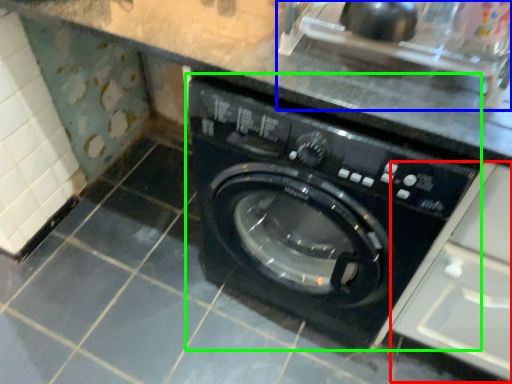
Question: Based on their relative distances, which object is farther from drawer (highlighted by a red box)? Choose from sink (highlighted by a blue box) and washing machine (highlighted by a green box).

Choices:
 (A) sink
 (B) washing machine

Answer: (A)